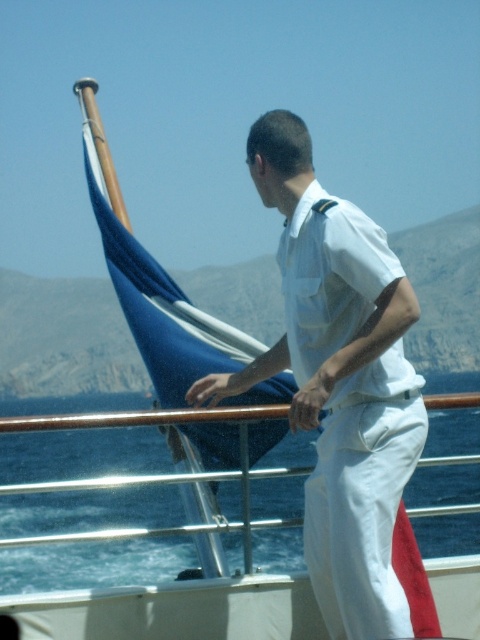
You are on a boat and want to determine the position of two points marked on the deck. The first point is at coordinates point (324, 378) and the second is at point (243, 387). From your vantage point, which point is closer to you?

Point (324, 378) is in front of point (243, 387), so it is closer to you.

You are observing the scene on the boat and notice the white cotton shirt at center and the white matte hand at center. Which object is positioned to the right of the other?

The white cotton shirt at center is to the right of the white matte hand at center.

Based on the photo, you are a photographer trying to capture the perfect shot of the scene on the boat. You want to focus on the person in the naval uniform. Where exactly should you aim your camera to ensure the matte white hand at center is in the frame?

You should aim your camera at point (310, 401) to ensure the matte white hand at center is in the frame.